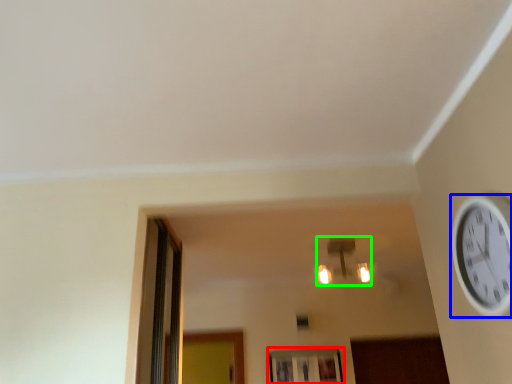
Question: Estimate the real-world distances between objects in this image. Which object is closer to window (highlighted by a red box), wall clock (highlighted by a blue box) or light fixture (highlighted by a green box)?

Choices:
 (A) wall clock
 (B) light fixture

Answer: (B)